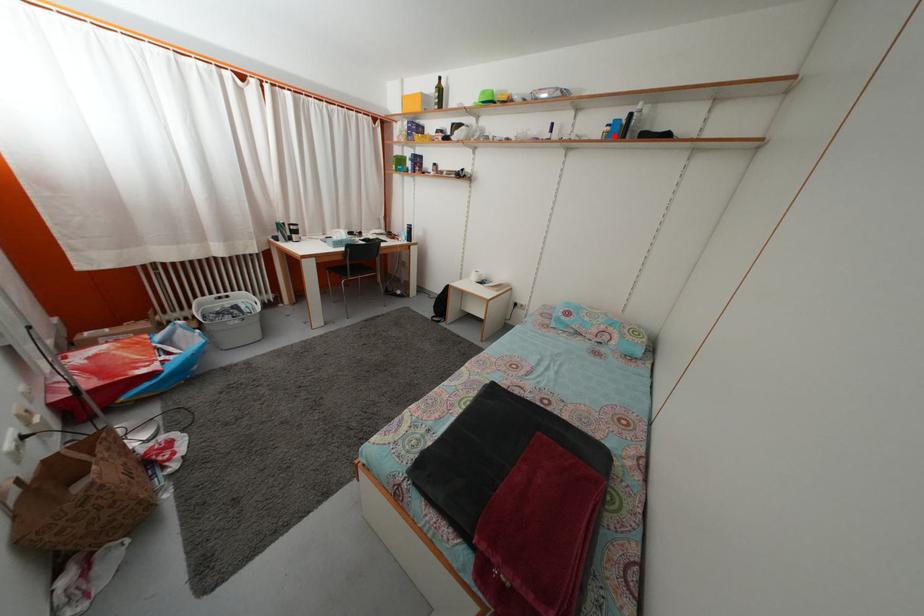
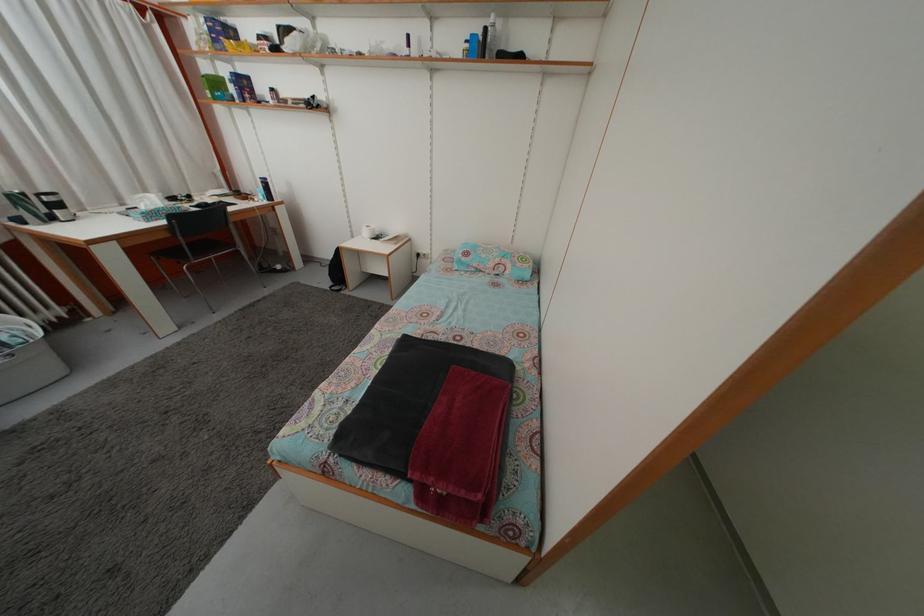
Question: I am providing you with two images of the same scene from different viewpoints. A red point is marked on the first image. Can you still see the location of the red point in image 2?

Choices:
 (A) Yes
 (B) No

Answer: (A)